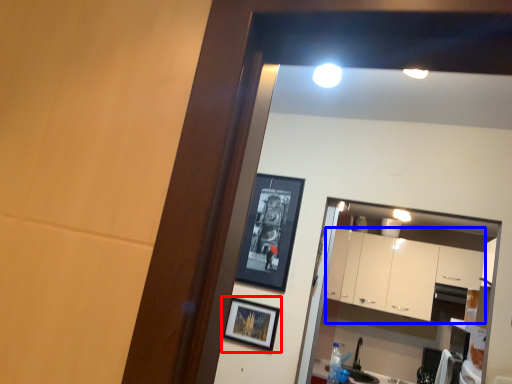
Question: Which object is closer to the camera taking this photo, picture frame (highlighted by a red box) or cabinetry (highlighted by a blue box)?

Choices:
 (A) picture frame
 (B) cabinetry

Answer: (A)